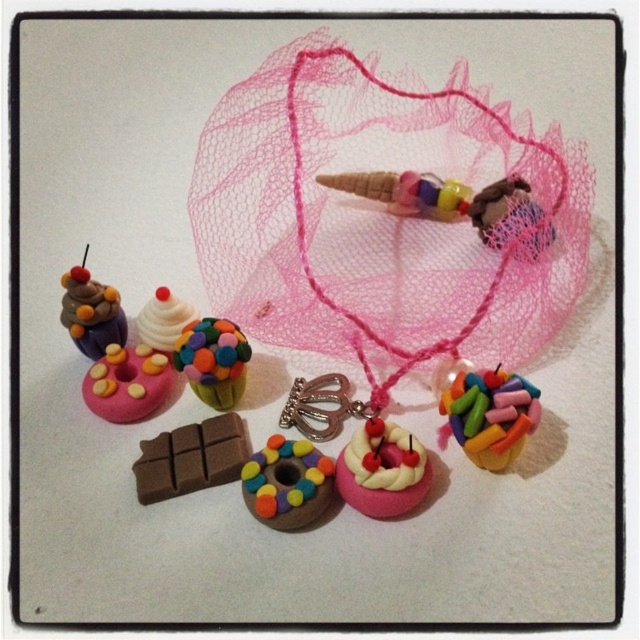
Who is higher up, pink mesh net at center or matte chocolate cupcake at left?

pink mesh net at center

Between pink mesh net at center and matte chocolate cupcake at left, which one appears on the left side from the viewer's perspective?

Positioned to the left is matte chocolate cupcake at left.

Where is `pink mesh net at center`? The image size is (640, 640). pink mesh net at center is located at coordinates (380, 216).

Does matte pink cupcake with colorful sprinkles at center have a greater width compared to matte plastic candy at center?

Correct, the width of matte pink cupcake with colorful sprinkles at center exceeds that of matte plastic candy at center.

Does point (387, 456) come farther from viewer compared to point (241, 344)?

No, it is not.

I want to click on matte pink cupcake with colorful sprinkles at center, so click(381, 470).

Is brown matte chocolate bar at lower left further to the viewer compared to matte plastic candy at center?

No, it is not.

Does brown matte chocolate bar at lower left appear on the right side of matte plastic candy at center?

In fact, brown matte chocolate bar at lower left is to the left of matte plastic candy at center.

The image size is (640, 640). What are the coordinates of `brown matte chocolate bar at lower left` in the screenshot? It's located at (189, 458).